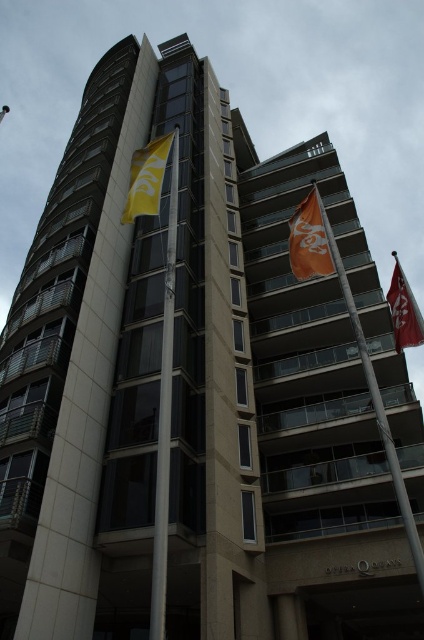
Question: Does orange fabric flag pole at center appear on the right side of yellow fabric flag at upper left?

Choices:
 (A) yes
 (B) no

Answer: (A)

Question: Based on their relative distances, which object is nearer to the orange fabric flag at upper center?

Choices:
 (A) yellow fabric flag at upper left
 (B) red fabric flag at upper right
 (C) orange fabric flag pole at center
 (D) white metallic pole at center

Answer: (C)

Question: Can you confirm if white metallic pole at center is positioned below red fabric flag at upper right?

Choices:
 (A) yes
 (B) no

Answer: (A)

Question: Does white metallic pole at center come in front of orange fabric flag at upper center?

Choices:
 (A) yes
 (B) no

Answer: (A)

Question: Which of the following is the closest to the observer?

Choices:
 (A) red fabric flag at upper right
 (B) yellow fabric flag at upper left
 (C) orange fabric flag at upper center
 (D) orange fabric flag pole at center

Answer: (D)

Question: Which point is closer to the camera taking this photo?

Choices:
 (A) (172, 134)
 (B) (295, 228)
 (C) (406, 288)
 (D) (176, 188)

Answer: (C)